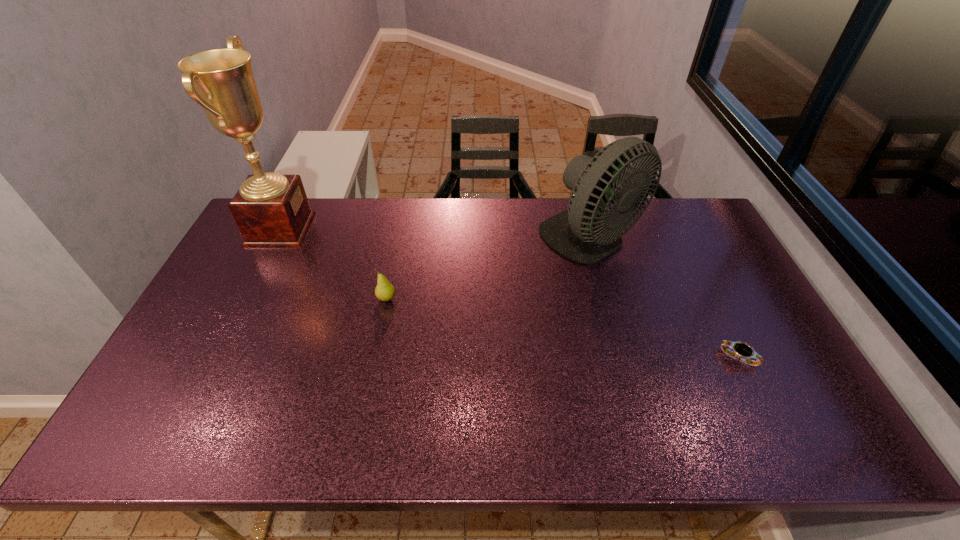
This screenshot has width=960, height=540. I want to click on free space at the right edge of the desktop, so click(686, 256).

Identify the location of free spot between the third tallest object and the second tallest object. (489, 271).

The width and height of the screenshot is (960, 540). What are the coordinates of `free space between the watch and the tallest object` in the screenshot? It's located at (510, 293).

Locate an element on the screen. The image size is (960, 540). vacant area that lies between the nearest object and the second tallest object is located at coordinates (664, 300).

Identify the location of vacant area that lies between the leftmost object and the second tallest object. Image resolution: width=960 pixels, height=540 pixels. (436, 235).

Identify the location of free space between the second nearest object and the shortest object. (563, 328).

You are a GUI agent. You are given a task and a screenshot of the screen. Output one action in this format:
    pyautogui.click(x=<x>, y=<y>)
    Task: Click on the vacant area that lies between the trophy cup and the second tallest object
    
    Given the screenshot: What is the action you would take?
    pyautogui.click(x=436, y=235)

Find the location of a particular element. free space between the tallest object and the fan is located at coordinates (436, 235).

This screenshot has width=960, height=540. I want to click on vacant space in between the fan and the nearest object, so click(x=664, y=300).

Locate an element on the screen. The image size is (960, 540). free spot between the third object from right to left and the shortest object is located at coordinates (563, 328).